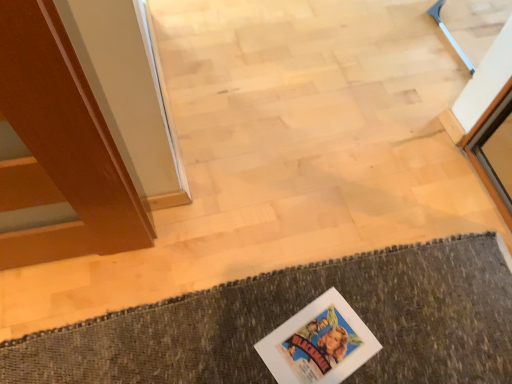
Where is `vacant space to the left of colorful paper comic book at lower center`? The height and width of the screenshot is (384, 512). vacant space to the left of colorful paper comic book at lower center is located at coordinates (236, 330).